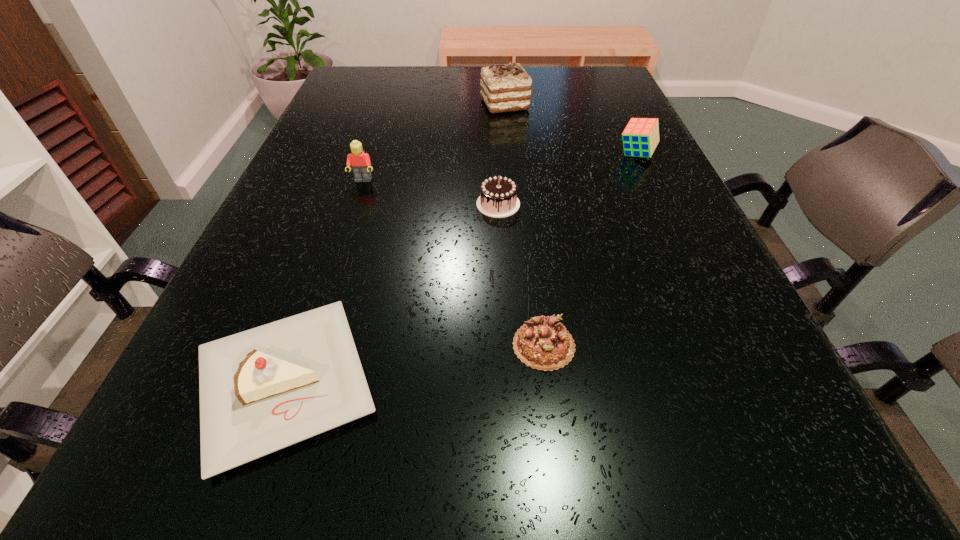
The height and width of the screenshot is (540, 960). In order to click on free region that satisfies the following two spatial constraints: 1. on the front side of the cube; 2. on the right side of the farthest object in this screenshot , I will do `click(509, 154)`.

Find the location of a particular element. This screenshot has height=540, width=960. free space that satisfies the following two spatial constraints: 1. on the face of the third farthest object; 2. on the right side of the second nearest chocolate cake is located at coordinates (355, 204).

Locate an element on the screen. vacant area in the image that satisfies the following two spatial constraints: 1. on the back side of the shortest chocolate cake; 2. on the right side of the rightmost object is located at coordinates (520, 154).

This screenshot has height=540, width=960. Find the location of `free space that satisfies the following two spatial constraints: 1. on the face of the second farthest chocolate cake; 2. on the right side of the Lego`. free space that satisfies the following two spatial constraints: 1. on the face of the second farthest chocolate cake; 2. on the right side of the Lego is located at coordinates (355, 204).

In order to click on free space that satisfies the following two spatial constraints: 1. on the back side of the rightmost object; 2. on the right side of the shortest chocolate cake in this screenshot , I will do `click(520, 154)`.